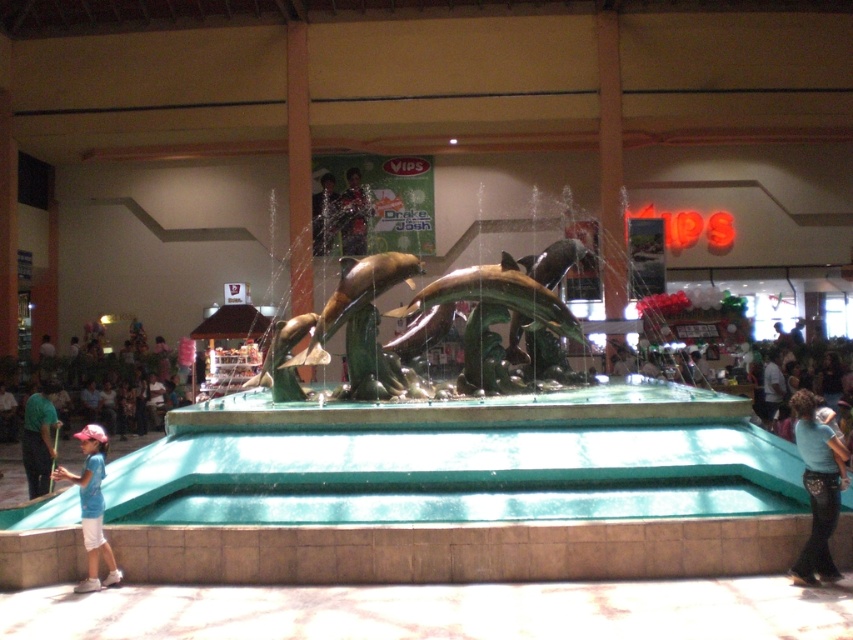
You are standing in the food court and see both the blue denim jeans at lower right and the blue cotton shirt at lower left. Which item is positioned higher up in the scene?

The blue denim jeans at lower right is above the blue cotton shirt at lower left, so it is positioned higher up in the scene.

You are standing at the entrance of the food court and see two points marked on the floor. The first point is at coordinate point [74,481] and the second is at point [51,454]. If you want to walk towards the fountain, which point should you step on first?

Point [74,481] is in front of point [51,454]. Therefore, if you want to walk towards the fountain, you should step on point [74,481] first as it is closer to your current position at the entrance.

You are trying to decide which shirt to wear for a casual day out. Both the blue cotton shirt at lower left and the green fabric shirt at left are options. Based on the image, which shirt has a wider width?

The blue cotton shirt at lower left might be wider than the green fabric shirt at left according to the image description.